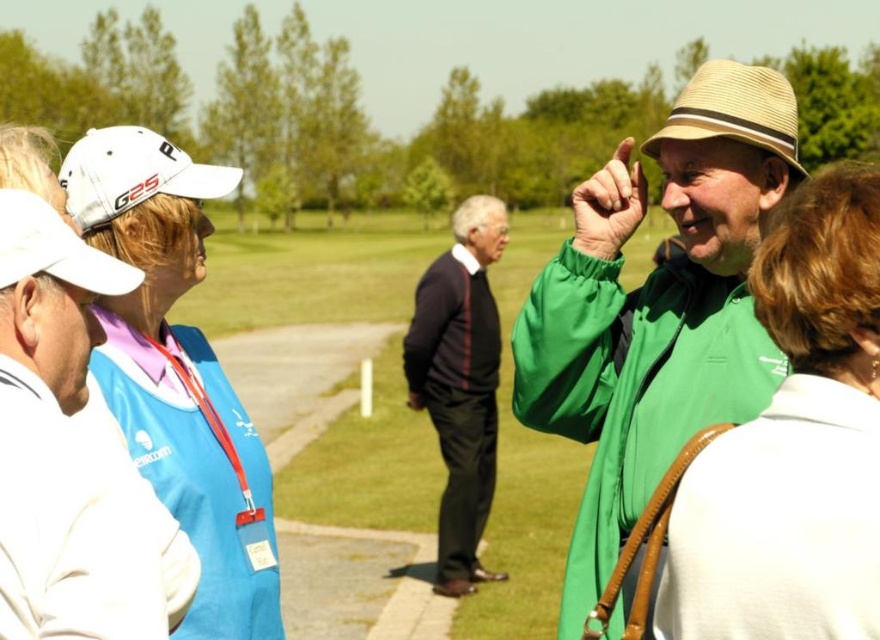
Which is behind, point (217, 614) or point (462, 496)?

The point (462, 496) is more distant.

Identify the location of white matte baseball cap at upper left. Image resolution: width=880 pixels, height=640 pixels. (177, 372).

Does point (53, 419) lie behind point (752, 83)?

No.

This screenshot has width=880, height=640. Describe the element at coordinates (62, 452) in the screenshot. I see `white fabric cap at upper left` at that location.

The width and height of the screenshot is (880, 640). Find the location of `white fabric cap at upper left`. white fabric cap at upper left is located at coordinates (62, 452).

Between green matte jacket at center and white straw hat at upper left, which one appears on the left side from the viewer's perspective?

white straw hat at upper left is more to the left.

Is point (670, 145) less distant than point (35, 195)?

No, it is not.

The image size is (880, 640). Find the location of `green matte jacket at center`. green matte jacket at center is located at coordinates (656, 308).